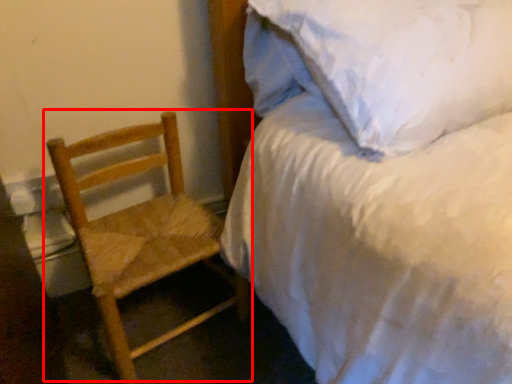
Question: Where is chair (annotated by the red box) located in relation to bed in the image?

Choices:
 (A) left
 (B) right

Answer: (A)